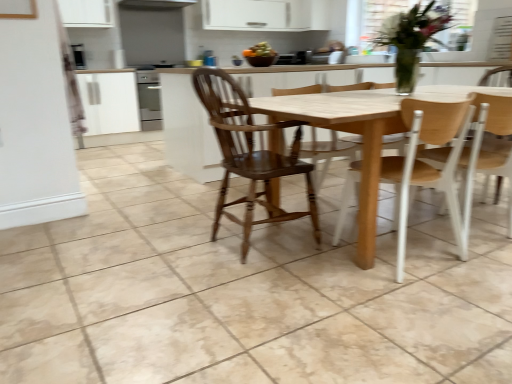
This screenshot has width=512, height=384. Find the location of `vacant area that is in front of wooden chair at center, acting as the first chair starting from the left`. vacant area that is in front of wooden chair at center, acting as the first chair starting from the left is located at coordinates (258, 292).